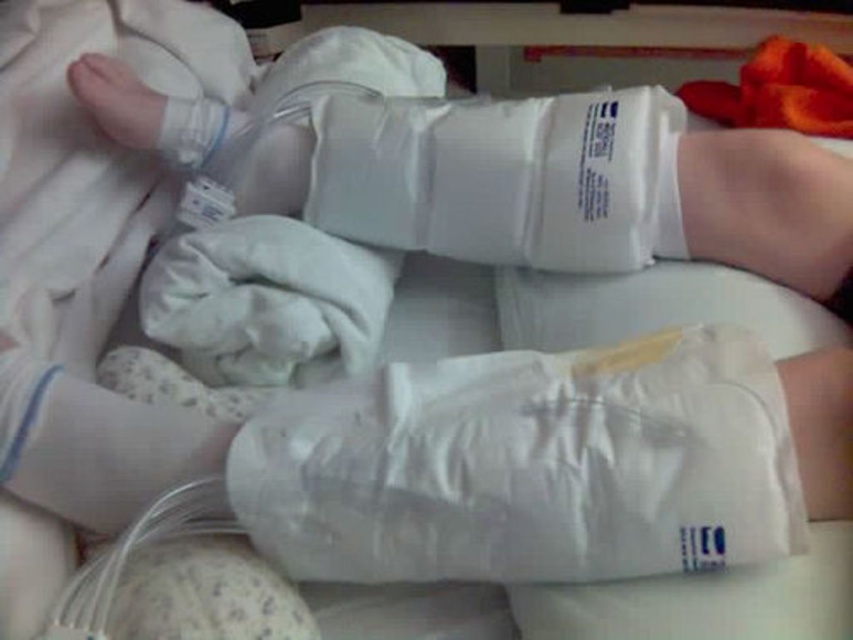
Does white matte bandage at center have a smaller size compared to white smooth foot at upper left?

No.

Can you confirm if white matte bandage at center is bigger than white smooth foot at upper left?

Yes, white matte bandage at center is bigger than white smooth foot at upper left.

Which is in front, point (508, 204) or point (149, 141)?

Positioned in front is point (508, 204).

Identify the location of white matte bandage at center. (503, 177).